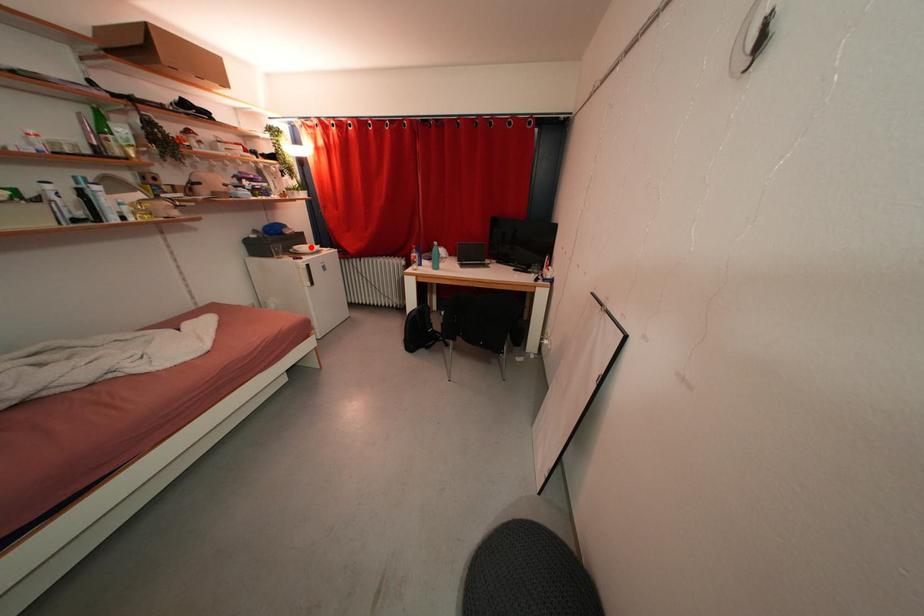
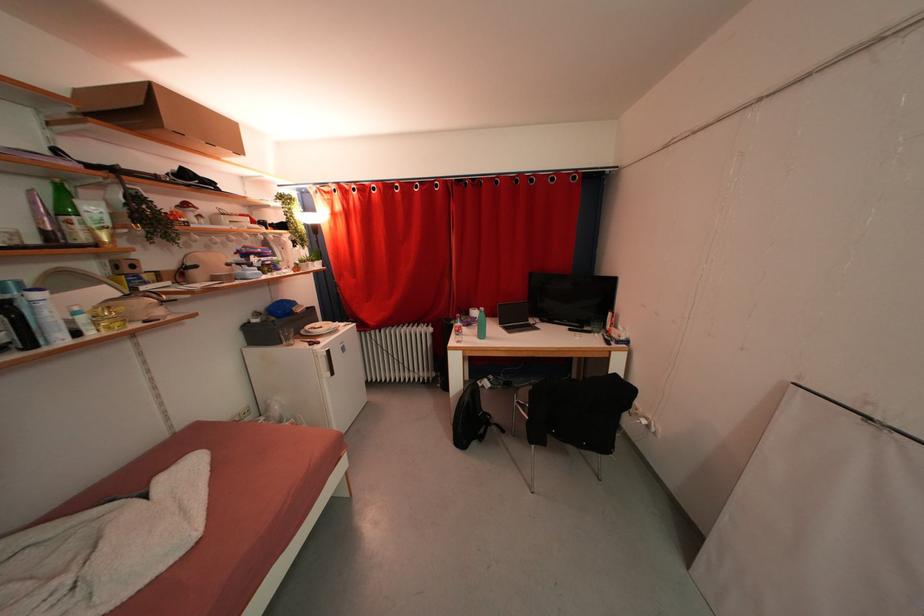
Question: I am providing you with two images of the same scene from different viewpoints. Given a red point in image1, look at the same physical point in image2. Is it:

Choices:
 (A) Closer to the viewpoint
 (B) Farther from the viewpoint

Answer: (B)